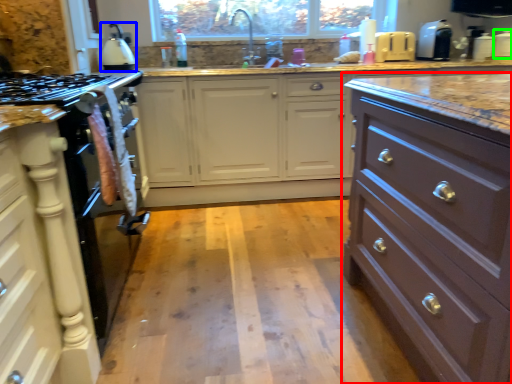
Question: Estimate the real-world distances between objects in this image. Which object is closer to chest of drawers (highlighted by a red box), kitchen appliance (highlighted by a blue box) or appliance (highlighted by a green box)?

Choices:
 (A) kitchen appliance
 (B) appliance

Answer: (A)